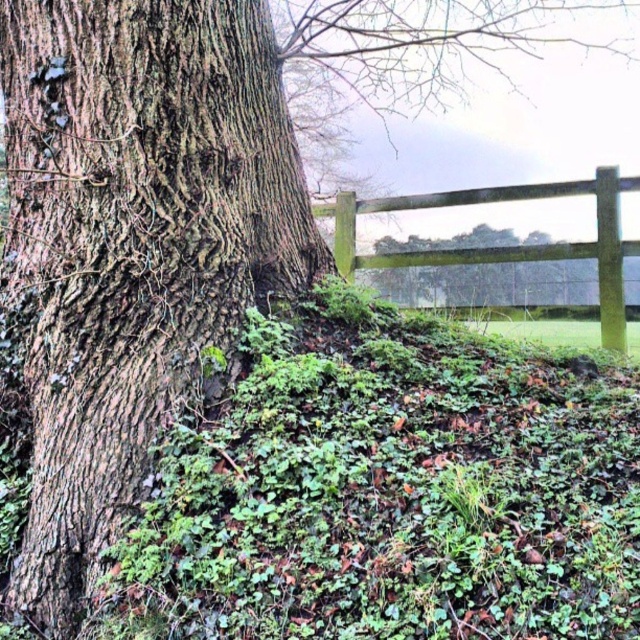
You are a painter standing in front of the scene. You want to paint the green wood fence at center and the green mossy tree at center. Which one should you look up more to paint?

The green wood fence at center is taller than the green mossy tree at center, so you should look up more to paint the green wood fence at center.

You are a park ranger assessing tree health. You notice the brown rough bark tree trunk at left and the green mossy tree at center. Which tree trunk is wider?

The brown rough bark tree trunk at left might be wider than the green mossy tree at center according to the description.